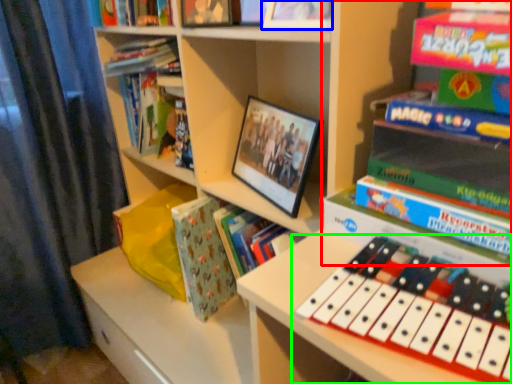
Question: Which object is the closest to the book (highlighted by a red box)? Choose among these: book (highlighted by a blue box) or musical keyboard (highlighted by a green box).

Choices:
 (A) book
 (B) musical keyboard

Answer: (A)